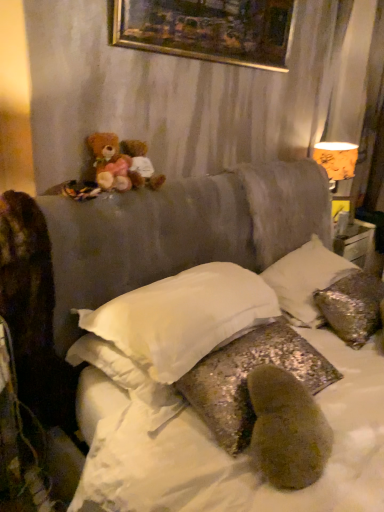
How much space does soft brown teddy bear at upper left, the first teddy bear in the left-to-right sequence, occupy vertically?

The height of soft brown teddy bear at upper left, the first teddy bear in the left-to-right sequence, is 8.38 inches.

The width and height of the screenshot is (384, 512). What do you see at coordinates (305, 280) in the screenshot?
I see `silver sequined pillow at upper right, acting as the 1th pillow starting from the right` at bounding box center [305, 280].

At what (x,y) coordinates should I click in order to perform the action: click on fluffy brown teddy bear at upper left, which appears as the second teddy bear when viewed from the left. Please return your answer as a coordinate pair (x, y). The height and width of the screenshot is (512, 384). Looking at the image, I should click on (141, 165).

This screenshot has width=384, height=512. Describe the element at coordinates (182, 316) in the screenshot. I see `white soft pillow at center, placed as the 3th pillow when sorted from right to left` at that location.

Image resolution: width=384 pixels, height=512 pixels. Find the location of `soft brown teddy bear at upper left, the first teddy bear in the left-to-right sequence`. soft brown teddy bear at upper left, the first teddy bear in the left-to-right sequence is located at coordinates (115, 162).

Can you confirm if white soft pillow at center, marked as the first pillow in a left-to-right arrangement, is wider than fluffy brown teddy bear at upper left, which appears as the second teddy bear when viewed from the left?

Yes.

Which is farther, (183, 311) or (163, 178)?

The point (163, 178) is farther.

How different are the orientations of white soft pillow at center, placed as the 3th pillow when sorted from right to left, and fluffy brown teddy bear at upper left, arranged as the 1th teddy bear when viewed from the right, in degrees?

The facing directions of white soft pillow at center, placed as the 3th pillow when sorted from right to left, and fluffy brown teddy bear at upper left, arranged as the 1th teddy bear when viewed from the right, are 0.0643 degrees apart.

Considering the sizes of objects white soft pillow at center, marked as the first pillow in a left-to-right arrangement, and fluffy brown teddy bear at upper left, which appears as the second teddy bear when viewed from the left, in the image provided, who is bigger, white soft pillow at center, marked as the first pillow in a left-to-right arrangement, or fluffy brown teddy bear at upper left, which appears as the second teddy bear when viewed from the left,?

Bigger between the two is white soft pillow at center, marked as the first pillow in a left-to-right arrangement.

Between fluffy brown teddy bear at upper left, which appears as the second teddy bear when viewed from the left, and soft brown teddy bear at upper left, which appears as the second teddy bear when viewed from the right, which one has less height?

fluffy brown teddy bear at upper left, which appears as the second teddy bear when viewed from the left.

Consider the image. From a real-world perspective, is fluffy brown teddy bear at upper left, arranged as the 1th teddy bear when viewed from the right, physically located above or below soft brown teddy bear at upper left, which appears as the second teddy bear when viewed from the right?

fluffy brown teddy bear at upper left, arranged as the 1th teddy bear when viewed from the right, is below soft brown teddy bear at upper left, which appears as the second teddy bear when viewed from the right.

Image resolution: width=384 pixels, height=512 pixels. In order to click on teddy bear lying behind the soft brown teddy bear at upper left, the first teddy bear in the left-to-right sequence in this screenshot , I will do `click(141, 165)`.

Visually, is white soft pillow at center, placed as the 3th pillow when sorted from right to left, positioned to the left or to the right of soft brown teddy bear at upper left, the first teddy bear in the left-to-right sequence?

Based on their positions, white soft pillow at center, placed as the 3th pillow when sorted from right to left, is located to the right of soft brown teddy bear at upper left, the first teddy bear in the left-to-right sequence.

Could you measure the distance between white soft pillow at center, marked as the first pillow in a left-to-right arrangement, and soft brown teddy bear at upper left, which appears as the second teddy bear when viewed from the right?

They are 21.13 inches apart.

Which object is wider, white soft pillow at center, placed as the 3th pillow when sorted from right to left, or soft brown teddy bear at upper left, the first teddy bear in the left-to-right sequence?

Wider between the two is white soft pillow at center, placed as the 3th pillow when sorted from right to left.

Is white soft pillow at center, marked as the first pillow in a left-to-right arrangement, bigger or smaller than soft brown teddy bear at upper left, the first teddy bear in the left-to-right sequence?

Considering their sizes, white soft pillow at center, marked as the first pillow in a left-to-right arrangement, takes up more space than soft brown teddy bear at upper left, the first teddy bear in the left-to-right sequence.

From the image's perspective, is silver sequined pillow at upper right, acting as the 1th pillow starting from the right, located above or below orange paper lampshade at upper right?

silver sequined pillow at upper right, acting as the 1th pillow starting from the right, is below orange paper lampshade at upper right.

Does silver sequined pillow at upper right, which is the 3th pillow from left to right, turn towards orange paper lampshade at upper right?

No, silver sequined pillow at upper right, which is the 3th pillow from left to right, does not turn towards orange paper lampshade at upper right.

Can you tell me how much silver sequined pillow at upper right, which is the 3th pillow from left to right, and orange paper lampshade at upper right differ in facing direction?

They differ by 0.916 degrees in their facing directions.

Is point (353, 269) positioned behind point (117, 329)?

Yes, point (353, 269) is farther from viewer.

Is silver sequined pillow at upper right, which is the 3th pillow from left to right, to the left of white soft pillow at center, marked as the first pillow in a left-to-right arrangement, from the viewer's perspective?

In fact, silver sequined pillow at upper right, which is the 3th pillow from left to right, is to the right of white soft pillow at center, marked as the first pillow in a left-to-right arrangement.

Is silver sequined pillow at upper right, acting as the 1th pillow starting from the right, shorter than white soft pillow at center, placed as the 3th pillow when sorted from right to left?

In fact, silver sequined pillow at upper right, acting as the 1th pillow starting from the right, may be taller than white soft pillow at center, placed as the 3th pillow when sorted from right to left.

From the image's perspective, is silver sequined pillow at upper right, acting as the 1th pillow starting from the right, on white soft pillow at center, placed as the 3th pillow when sorted from right to left?

Correct, silver sequined pillow at upper right, acting as the 1th pillow starting from the right, appears higher than white soft pillow at center, placed as the 3th pillow when sorted from right to left, in the image.

From the image's perspective, which one is positioned higher, fluffy brown teddy bear at upper left, which appears as the second teddy bear when viewed from the left, or glittery sequined pillow at center, positioned as the second pillow in right-to-left order?

fluffy brown teddy bear at upper left, which appears as the second teddy bear when viewed from the left.

Is fluffy brown teddy bear at upper left, arranged as the 1th teddy bear when viewed from the right, not close to glittery sequined pillow at center, positioned as the second pillow in right-to-left order?

No, fluffy brown teddy bear at upper left, arranged as the 1th teddy bear when viewed from the right, is in close proximity to glittery sequined pillow at center, positioned as the second pillow in right-to-left order.

Who is bigger, fluffy brown teddy bear at upper left, arranged as the 1th teddy bear when viewed from the right, or glittery sequined pillow at center, the 2th pillow from the left?

With larger size is glittery sequined pillow at center, the 2th pillow from the left.

Considering the positions of objects fluffy brown teddy bear at upper left, arranged as the 1th teddy bear when viewed from the right, and glittery sequined pillow at center, the 2th pillow from the left, in the image provided, who is in front, fluffy brown teddy bear at upper left, arranged as the 1th teddy bear when viewed from the right, or glittery sequined pillow at center, the 2th pillow from the left,?

glittery sequined pillow at center, the 2th pillow from the left, is more forward.

Is soft brown teddy bear at upper left, which appears as the second teddy bear when viewed from the right, far from silver sequined pillow at upper right, which is the 3th pillow from left to right?

soft brown teddy bear at upper left, which appears as the second teddy bear when viewed from the right, is actually quite close to silver sequined pillow at upper right, which is the 3th pillow from left to right.

From the image's perspective, which one is positioned higher, soft brown teddy bear at upper left, the first teddy bear in the left-to-right sequence, or silver sequined pillow at upper right, which is the 3th pillow from left to right?

soft brown teddy bear at upper left, the first teddy bear in the left-to-right sequence, is shown above in the image.

Is soft brown teddy bear at upper left, which appears as the second teddy bear when viewed from the right, oriented towards silver sequined pillow at upper right, acting as the 1th pillow starting from the right?

No, soft brown teddy bear at upper left, which appears as the second teddy bear when viewed from the right, does not turn towards silver sequined pillow at upper right, acting as the 1th pillow starting from the right.

Is soft brown teddy bear at upper left, the first teddy bear in the left-to-right sequence, further to camera compared to silver sequined pillow at upper right, acting as the 1th pillow starting from the right?

No, soft brown teddy bear at upper left, the first teddy bear in the left-to-right sequence, is in front of silver sequined pillow at upper right, acting as the 1th pillow starting from the right.

I want to click on the 1st teddy bear counting from the left side of the white soft pillow at center, marked as the first pillow in a left-to-right arrangement, so click(x=141, y=165).

Where is `teddy bear above the soft brown teddy bear at upper left, which appears as the second teddy bear when viewed from the right (from the image's perspective)`? This screenshot has width=384, height=512. teddy bear above the soft brown teddy bear at upper left, which appears as the second teddy bear when viewed from the right (from the image's perspective) is located at coordinates (141, 165).

Estimate the real-world distances between objects in this image. Which object is closer to white soft pillow at center, marked as the first pillow in a left-to-right arrangement, silver sequined pillow at upper right, which is the 3th pillow from left to right, or soft brown teddy bear at upper left, the first teddy bear in the left-to-right sequence?

The object closer to white soft pillow at center, marked as the first pillow in a left-to-right arrangement, is soft brown teddy bear at upper left, the first teddy bear in the left-to-right sequence.

When comparing their distances from white soft pillow at center, marked as the first pillow in a left-to-right arrangement, does silver sequined pillow at upper right, acting as the 1th pillow starting from the right, or orange paper lampshade at upper right seem closer?

silver sequined pillow at upper right, acting as the 1th pillow starting from the right, is positioned closer to the anchor white soft pillow at center, marked as the first pillow in a left-to-right arrangement.

From the image, which object appears to be farther from soft brown teddy bear at upper left, which appears as the second teddy bear when viewed from the right, orange paper lampshade at upper right or gold-framed painting at upper center?

orange paper lampshade at upper right.

Estimate the real-world distances between objects in this image. Which object is further from white soft pillow at center, marked as the first pillow in a left-to-right arrangement, glittery sequined pillow at center, the 2th pillow from the left, or gold-framed painting at upper center?

gold-framed painting at upper center is further to white soft pillow at center, marked as the first pillow in a left-to-right arrangement.

Consider the image. Considering their positions, is fluffy brown teddy bear at upper left, arranged as the 1th teddy bear when viewed from the right, positioned closer to glittery sequined pillow at center, the 2th pillow from the left, than soft brown teddy bear at upper left, the first teddy bear in the left-to-right sequence?

The object closer to glittery sequined pillow at center, the 2th pillow from the left, is soft brown teddy bear at upper left, the first teddy bear in the left-to-right sequence.

Based on their spatial positions, is fluffy brown teddy bear at upper left, arranged as the 1th teddy bear when viewed from the right, or gold-framed painting at upper center closer to orange paper lampshade at upper right?

gold-framed painting at upper center is positioned closer to the anchor orange paper lampshade at upper right.

Estimate the real-world distances between objects in this image. Which object is further from orange paper lampshade at upper right, gold-framed painting at upper center or fluffy brown teddy bear at upper left, which appears as the second teddy bear when viewed from the left?

Among the two, fluffy brown teddy bear at upper left, which appears as the second teddy bear when viewed from the left, is located further to orange paper lampshade at upper right.

Based on their spatial positions, is fluffy brown teddy bear at upper left, arranged as the 1th teddy bear when viewed from the right, or white soft pillow at center, marked as the first pillow in a left-to-right arrangement, further from gold-framed painting at upper center?

white soft pillow at center, marked as the first pillow in a left-to-right arrangement, lies further to gold-framed painting at upper center than the other object.

Where is `teddy bear between fluffy brown teddy bear at upper left, arranged as the 1th teddy bear when viewed from the right, and white soft pillow at center, placed as the 3th pillow when sorted from right to left, vertically`? Image resolution: width=384 pixels, height=512 pixels. teddy bear between fluffy brown teddy bear at upper left, arranged as the 1th teddy bear when viewed from the right, and white soft pillow at center, placed as the 3th pillow when sorted from right to left, vertically is located at coordinates (115, 162).

This screenshot has height=512, width=384. I want to click on teddy bear situated between soft brown teddy bear at upper left, the first teddy bear in the left-to-right sequence, and silver sequined pillow at upper right, acting as the 1th pillow starting from the right, from left to right, so click(141, 165).

Find the location of a particular element. teddy bear between soft brown teddy bear at upper left, which appears as the second teddy bear when viewed from the right, and orange paper lampshade at upper right, in the horizontal direction is located at coordinates (141, 165).

This screenshot has width=384, height=512. I want to click on pillow between white soft pillow at center, marked as the first pillow in a left-to-right arrangement, and orange paper lampshade at upper right from front to back, so (x=305, y=280).